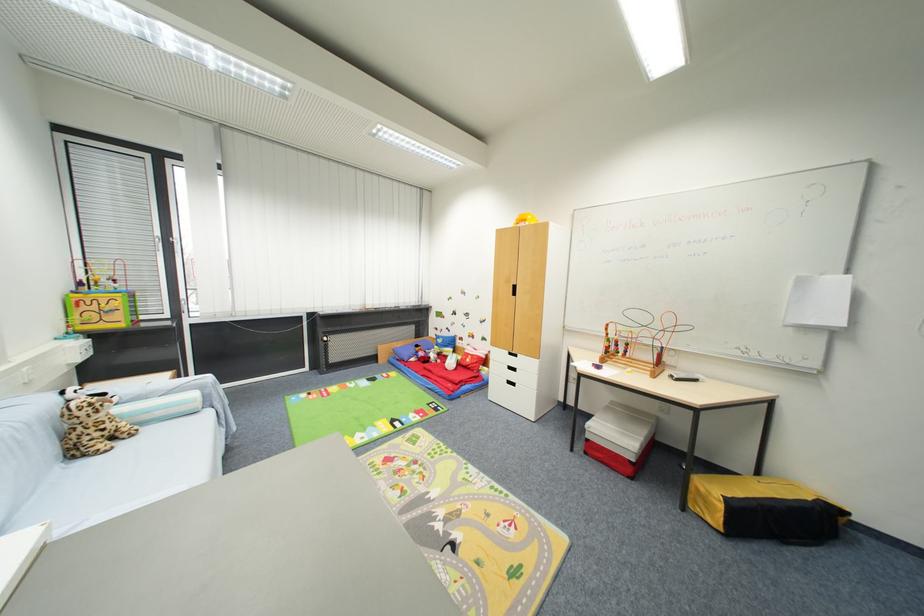
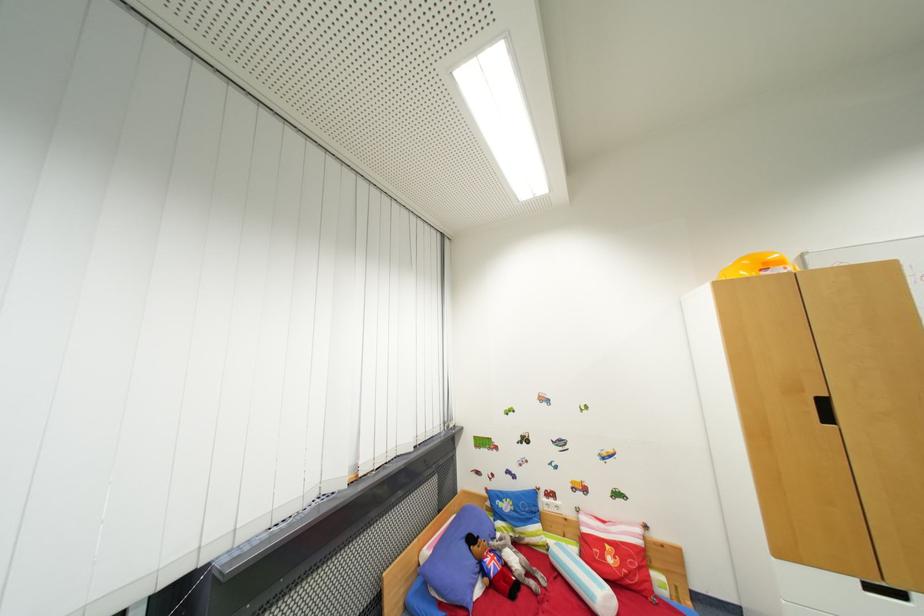
In the second image, find the point that corresponds to (x=464, y=345) in the first image.

(550, 506)